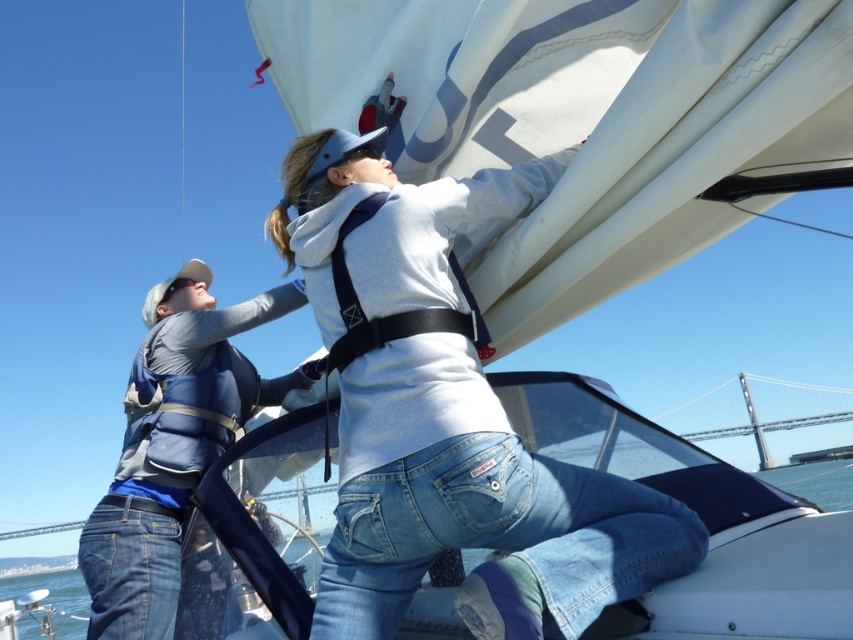
You are a photographer trying to capture a photo of the sailboat scene. You want to ensure both the matte gray hoodie at center and the metallic gray bridge at upper right are clearly visible in the frame. Based on their positions, which object should you focus on first to ensure both are in focus?

The matte gray hoodie at center is in front of the metallic gray bridge at upper right. To ensure both are in focus, you should focus on the matte gray hoodie at center first, as it is closer to the camera, and the bridge will naturally fall into the depth of field behind it.

You are a photographer on a nearby boat and want to take a photo of the matte gray hoodie at center and the metallic gray bridge at upper right in the same frame. Based on their positions, which object should you focus on first to ensure both are in the shot?

The matte gray hoodie at center is to the left of the metallic gray bridge at upper right, so you should focus on the matte gray hoodie at center first to ensure both are in the shot.

You are a safety inspector on a boat and need to ensure the blue denim jeans at lower center and the blue fabric life vest at left are within a safe proximity of 1.5 meters for quick access. Based on the scene, are they within the required distance?

The distance between the blue denim jeans at lower center and the blue fabric life vest at left is 1.47 meters, which is within the 1.5 meters safety requirement. Therefore, they are within the required distance for quick access.